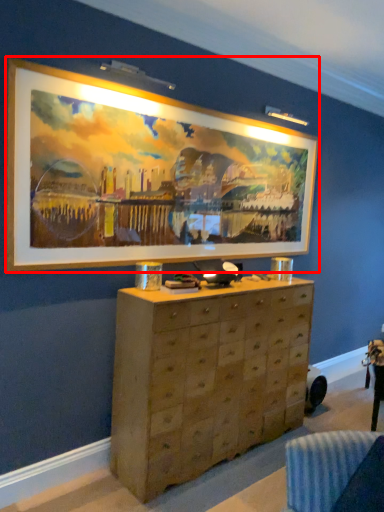
Question: In this image, where is picture frame (annotated by the red box) located relative to chest of drawers?

Choices:
 (A) left
 (B) right

Answer: (A)